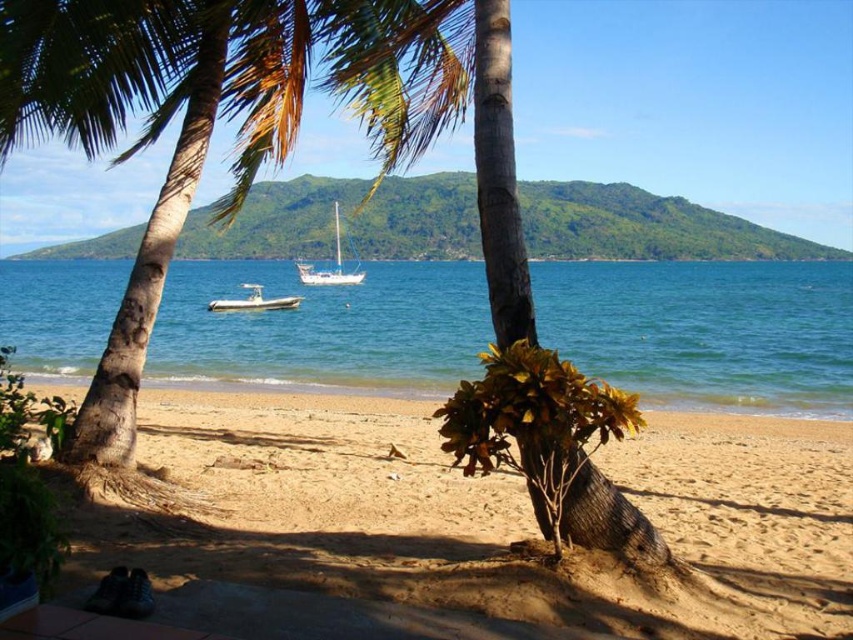
Who is more forward, (x=401, y=301) or (x=331, y=284)?

Point (x=401, y=301) is in front.

This screenshot has width=853, height=640. What are the coordinates of `clear blue water at center` in the screenshot? It's located at (706, 330).

Is clear blue water at center wider than green leafy palm tree at center?

Indeed, clear blue water at center has a greater width compared to green leafy palm tree at center.

Does clear blue water at center have a lesser width compared to green leafy palm tree at center?

In fact, clear blue water at center might be wider than green leafy palm tree at center.

Who is more forward, (641, 292) or (347, 100)?

Point (347, 100) is in front.

You are a GUI agent. You are given a task and a screenshot of the screen. Output one action in this format:
    pyautogui.click(x=<x>, y=<y>)
    Task: Click on the clear blue water at center
    The width and height of the screenshot is (853, 640).
    Given the screenshot: What is the action you would take?
    pyautogui.click(x=706, y=330)

Is sandy beach at lower center positioned behind white glossy sailboat at center?

That is False.

Is sandy beach at lower center taller than white glossy sailboat at center?

No.

You are a GUI agent. You are given a task and a screenshot of the screen. Output one action in this format:
    pyautogui.click(x=<x>, y=<y>)
    Task: Click on the sandy beach at lower center
    The width and height of the screenshot is (853, 640).
    Given the screenshot: What is the action you would take?
    pyautogui.click(x=500, y=515)